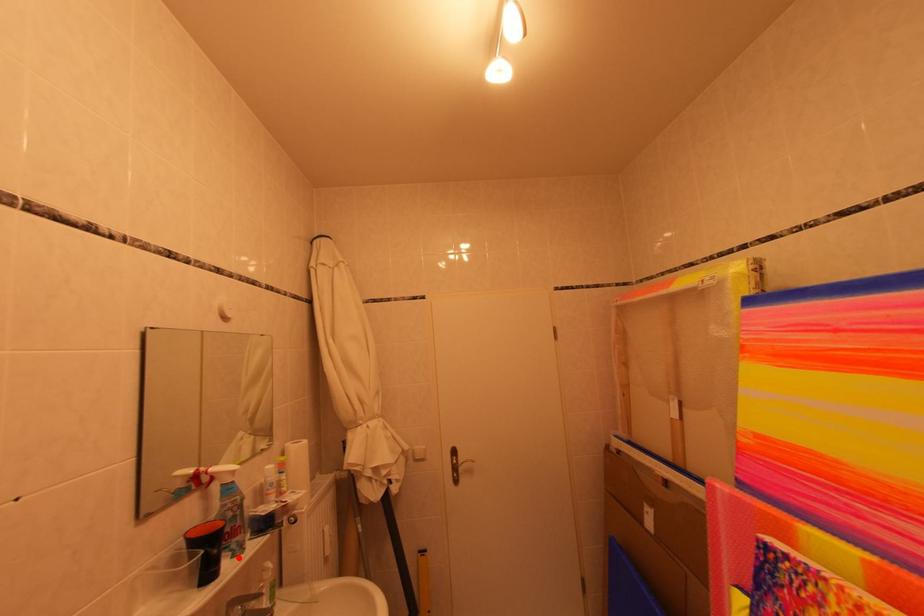
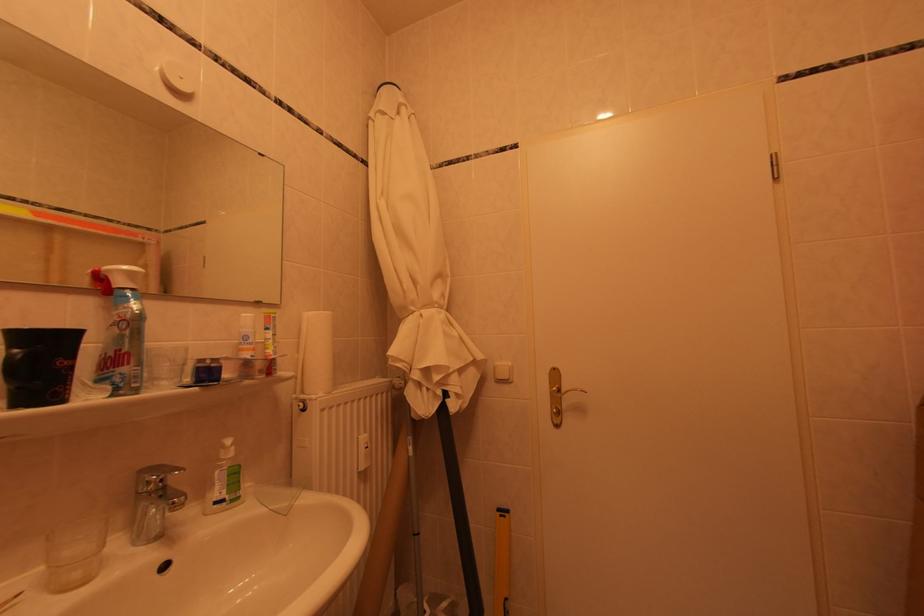
Where in the second image is the point corresponding to the highlighted location from the first image?

(119, 391)